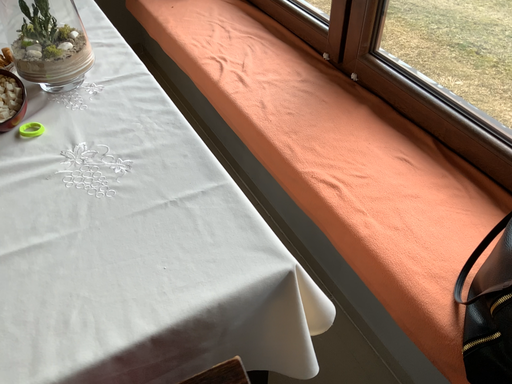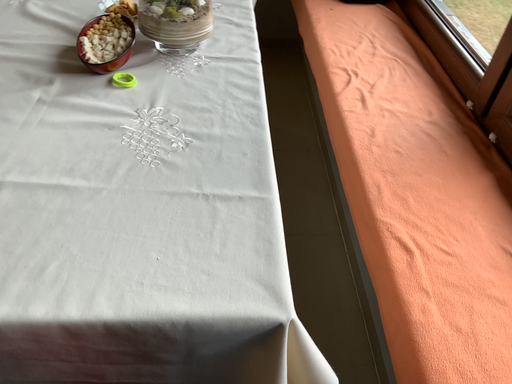
Question: Which way did the camera rotate in the video?

Choices:
 (A) rotated right
 (B) rotated left

Answer: (B)